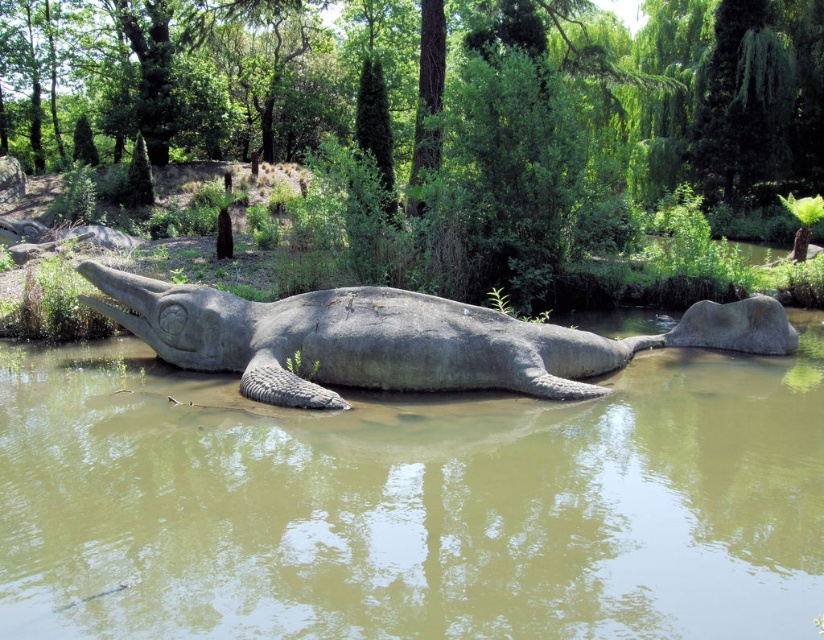
You are a maintenance worker tasked with cleaning the area between the brown matte water at center and the gray stone crocodile at center. Your cleaning equipment has a maximum reach of 4 feet. Can you clean the entire space between them without moving the equipment closer?

The distance between the brown matte water at center and the gray stone crocodile at center is 4.42 feet. Since your equipment has a maximum reach of 4 feet, you cannot clean the entire space between them without moving the equipment closer.

You are standing at the edge of the water in the serene outdoor scene and see two points marked in the image. One is at point (x=139, y=608) and the other at point (x=391, y=296). Which point is closer to you?

Point (x=139, y=608) is in front of point (x=391, y=296), so it is closer to you.

You are a park visitor who wants to take a photo of the gray stone crocodile at center without any water in the background. Is there a way to position yourself so that the brown matte water at center doesn not appear behind the crocodile?

The brown matte water at center is positioned under gray stone crocodile at center, so if you position yourself at an angle where the crocodile is above the water, the water will still be visible behind it. Alternatively, you could move closer to the sculpture so that the crocodile blocks the view of the water behind it, but this might depend on the sculpture design and surrounding landscape.